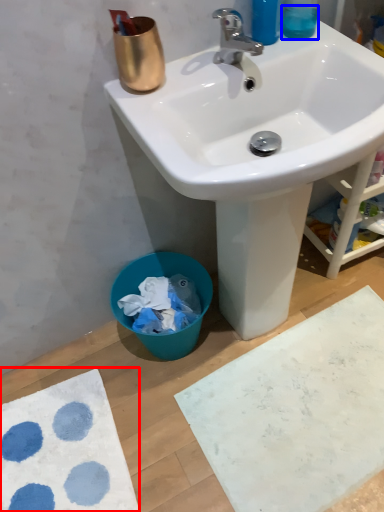
Question: Which of the following is the farthest to the observer, bath mat (highlighted by a red box) or liquid (highlighted by a blue box)?

Choices:
 (A) bath mat
 (B) liquid

Answer: (A)